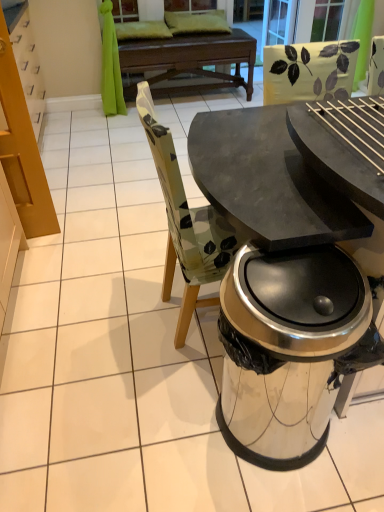
Question: From the image's perspective, is clear glass screen door at upper center, which is the 2th screen door in left-to-right order, positioned above or below matte black table at center?

Choices:
 (A) below
 (B) above

Answer: (B)

Question: Is clear glass screen door at upper center, which is the 2th screen door in left-to-right order, situated inside matte black table at center or outside?

Choices:
 (A) inside
 (B) outside

Answer: (B)

Question: Which is nearer to the dark wood round table at center?

Choices:
 (A) matte black table at center
 (B) shiny metallic trash can at lower right
 (C) transparent glass screen door at upper center, the 2th screen door positioned from the right
 (D) clear glass screen door at upper center, which is the 2th screen door in left-to-right order

Answer: (D)

Question: Which object is positioned closest to the shiny metallic trash can at lower right?

Choices:
 (A) dark wood round table at center
 (B) clear glass screen door at upper center, which is the 2th screen door in left-to-right order
 (C) matte black table at center
 (D) transparent glass screen door at upper center, which is the 1th screen door in left-to-right order

Answer: (C)